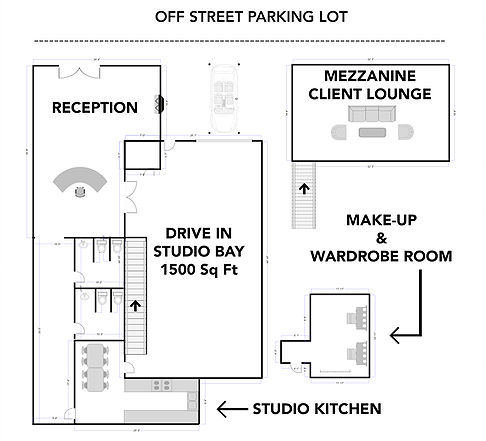
Where is `seats`? Image resolution: width=486 pixels, height=441 pixels. seats is located at coordinates (86, 386), (85, 373), (87, 359), (84, 351), (105, 350), (103, 362), (105, 373), (105, 387).